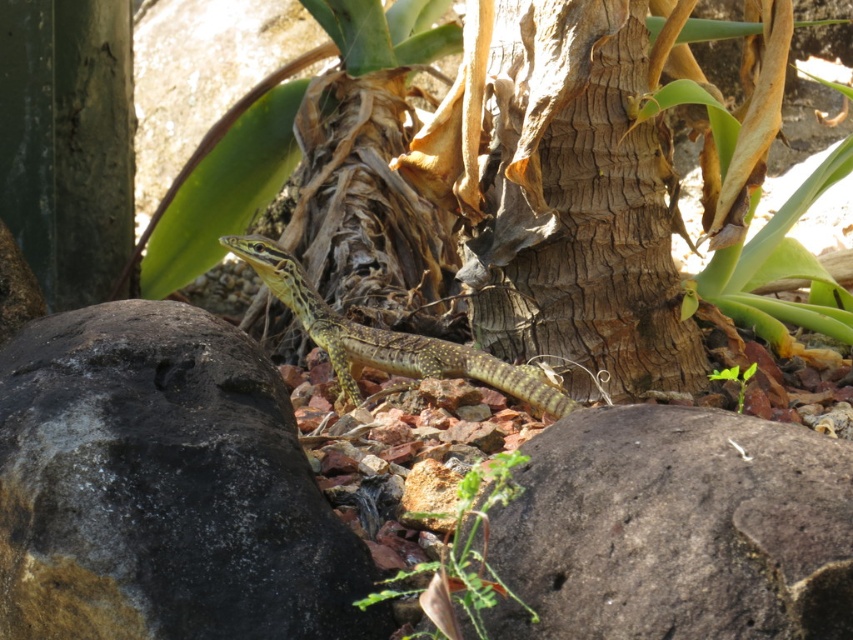
Question: Which point is closer to the camera?

Choices:
 (A) (428, 616)
 (B) (370, 352)
 (C) (733, 365)
 (D) (73, 608)

Answer: (A)

Question: Does rough textured rock at lower right come behind green leafy plant at center?

Choices:
 (A) yes
 (B) no

Answer: (B)

Question: Can you confirm if rough textured rock at lower right is bigger than green leafy plant at center?

Choices:
 (A) no
 (B) yes

Answer: (B)

Question: Is rough textured rock at lower right below green leafy plant at center?

Choices:
 (A) no
 (B) yes

Answer: (B)

Question: Which point is closer to the camera?

Choices:
 (A) (704, 371)
 (B) (276, 486)

Answer: (B)

Question: Which point appears farthest from the camera in this image?

Choices:
 (A) (451, 372)
 (B) (517, 460)
 (C) (9, 417)

Answer: (A)